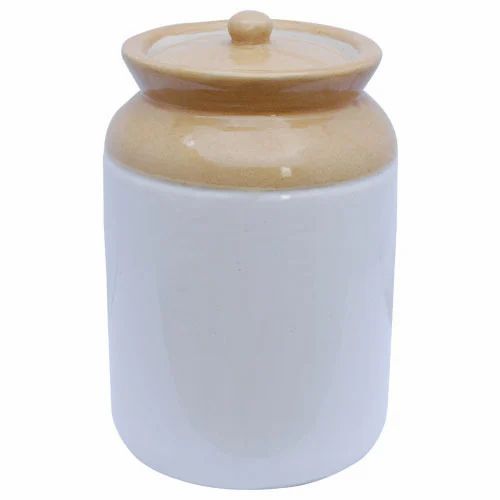
Image resolution: width=500 pixels, height=500 pixels. I want to click on brown jar knob handle, so click(x=246, y=27).